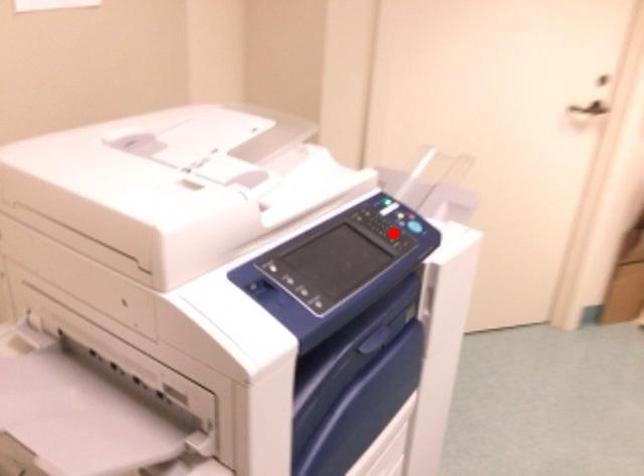
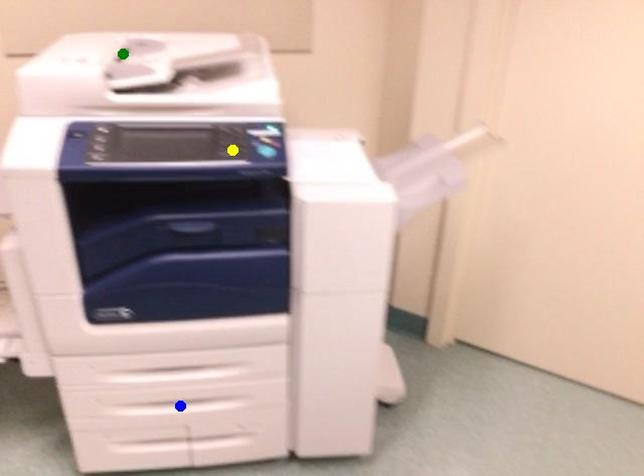
Question: I am providing you with two images of the same scene from different viewpoints. A red point is marked on the first image. You are given multiple points on the second image. Which mark in image 2 goes with the point in image 1?

Choices:
 (A) green point
 (B) yellow point
 (C) blue point

Answer: (B)